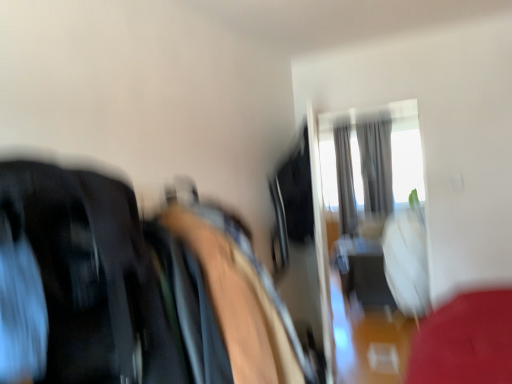
Question: From the image's perspective, is beige fabric bean bag chair at center located above or below transparent glass door at upper center?

Choices:
 (A) above
 (B) below

Answer: (B)

Question: Based on their positions, is beige fabric bean bag chair at center located to the left or right of transparent glass door at upper center?

Choices:
 (A) left
 (B) right

Answer: (A)

Question: Which is nearer to the beige fabric bean bag chair at center?

Choices:
 (A) silky gray curtain at upper center, placed as the 2th curtain when sorted from right to left
 (B) dark fabric clothes at left
 (C) gray fabric curtain at upper right, which appears as the 2th curtain when viewed from the left
 (D) transparent glass door at upper center

Answer: (B)

Question: Which of these objects is positioned closest to the beige fabric bean bag chair at center?

Choices:
 (A) dark fabric clothes at left
 (B) transparent glass door at upper center
 (C) gray fabric curtain at upper right, the 1th curtain from the right
 (D) silky gray curtain at upper center, placed as the 2th curtain when sorted from right to left

Answer: (A)